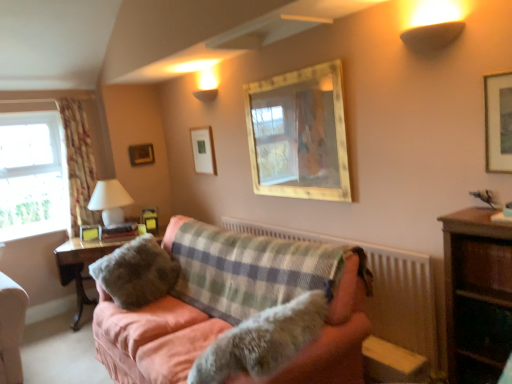
Question: Considering the positions of white glossy table lamp at left and clear glass window at left in the image, is white glossy table lamp at left taller or shorter than clear glass window at left?

Choices:
 (A) short
 (B) tall

Answer: (A)

Question: Is white glossy table lamp at left inside or outside of clear glass window at left?

Choices:
 (A) outside
 (B) inside

Answer: (A)

Question: Based on their relative distances, which object is nearer to the clear glass window at left?

Choices:
 (A) fuzzy fabric pillow at center
 (B) matte yellow picture frame at center, which is the third picture frame from left to right
 (C) fuzzy fur dog at center
 (D) woodenmaterial/texturetable at left, which appears as the second table when viewed from the front
 (E) plaid fabric couch at center

Answer: (D)

Question: Which of these objects is positioned closest to the white glossy table lamp at left?

Choices:
 (A) floral fabric curtain at left
 (B) wooden bookshelf at right, which ranks as the second table in left-to-right order
 (C) wooden picture frame at lower left, which ranks as the 6th picture frame in right-to-left order
 (D) gold textured mirror at upper center, the second picture frame positioned from the front
 (E) fuzzy fur dog at center

Answer: (C)